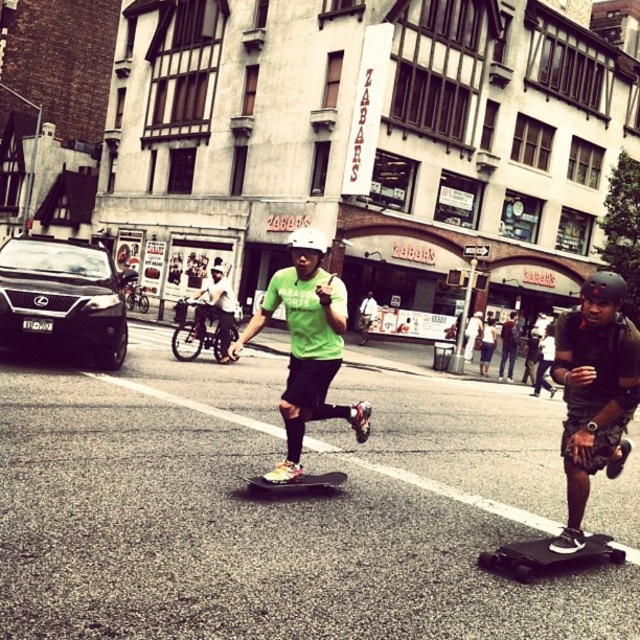
Question: Based on their relative distances, which object is nearer to the black rubber skateboard at center?

Choices:
 (A) black matte skateboard at right
 (B) white helmet at center
 (C) white matte helmet at center
 (D) black matte helmet at right

Answer: (C)

Question: Which point is closer to the camera?

Choices:
 (A) black matte helmet at right
 (B) green matte skateboard at center
 (C) white matte helmet at center
 (D) black rubber skateboard at center

Answer: (A)

Question: Does white helmet at center appear over black rubber skateboard at center?

Choices:
 (A) no
 (B) yes

Answer: (B)

Question: Is black matte skateboard at center bigger than black matte helmet at right?

Choices:
 (A) yes
 (B) no

Answer: (B)

Question: Which of these objects is positioned closest to the green matte skateboard at center?

Choices:
 (A) white helmet at center
 (B) black rubber skateboard at center
 (C) black matte skateboard at center
 (D) white matte helmet at center

Answer: (B)

Question: Where is black matte skateboard at right located in relation to black rubber skateboard at center in the image?

Choices:
 (A) below
 (B) above

Answer: (B)